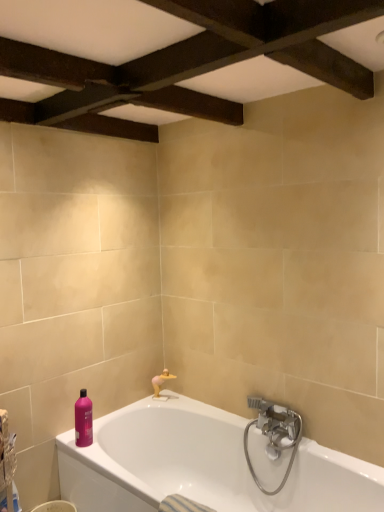
Question: From the image's perspective, is pink glossy bottle at lower left on white glossy bathtub at lower center?

Choices:
 (A) yes
 (B) no

Answer: (A)

Question: Can you confirm if pink glossy bottle at lower left is shorter than white glossy bathtub at lower center?

Choices:
 (A) yes
 (B) no

Answer: (A)

Question: From the image's perspective, is pink glossy bottle at lower left beneath white glossy bathtub at lower center?

Choices:
 (A) no
 (B) yes

Answer: (A)

Question: Is pink glossy bottle at lower left not inside white glossy bathtub at lower center?

Choices:
 (A) no
 (B) yes

Answer: (B)

Question: Considering the relative positions of pink glossy bottle at lower left and white glossy bathtub at lower center in the image provided, is pink glossy bottle at lower left to the left of white glossy bathtub at lower center from the viewer's perspective?

Choices:
 (A) yes
 (B) no

Answer: (A)

Question: Is pink glossy bottle at lower left bigger than white glossy bathtub at lower center?

Choices:
 (A) yes
 (B) no

Answer: (B)

Question: From the image's perspective, is satin nickel faucet at lower right located above matte gold faucet at lower center?

Choices:
 (A) no
 (B) yes

Answer: (A)

Question: Considering the relative sizes of satin nickel faucet at lower right and matte gold faucet at lower center in the image provided, is satin nickel faucet at lower right wider than matte gold faucet at lower center?

Choices:
 (A) yes
 (B) no

Answer: (A)

Question: Is satin nickel faucet at lower right in contact with matte gold faucet at lower center?

Choices:
 (A) yes
 (B) no

Answer: (B)

Question: Can you confirm if satin nickel faucet at lower right is bigger than matte gold faucet at lower center?

Choices:
 (A) yes
 (B) no

Answer: (A)

Question: From the image's perspective, is satin nickel faucet at lower right located beneath matte gold faucet at lower center?

Choices:
 (A) no
 (B) yes

Answer: (B)

Question: Can you confirm if satin nickel faucet at lower right is smaller than matte gold faucet at lower center?

Choices:
 (A) no
 (B) yes

Answer: (A)

Question: From the image's perspective, is plastic woven basket at lower left over matte gold faucet at lower center?

Choices:
 (A) no
 (B) yes

Answer: (A)